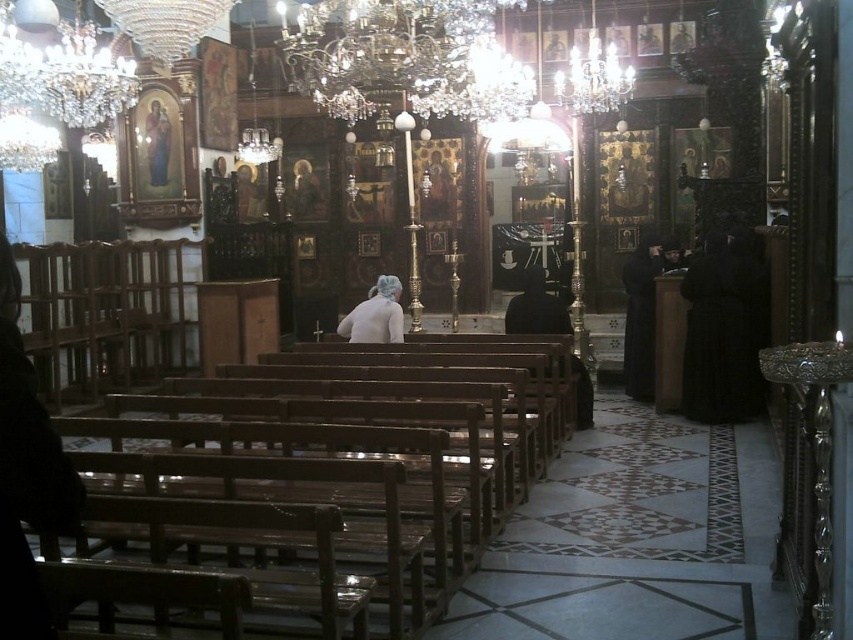
Is black velvet robe at center behind white matte hair at center?

Yes, it is behind white matte hair at center.

The image size is (853, 640). What do you see at coordinates (537, 307) in the screenshot?
I see `black velvet robe at center` at bounding box center [537, 307].

The height and width of the screenshot is (640, 853). Find the location of `black velvet robe at center`. black velvet robe at center is located at coordinates (537, 307).

Between crystal glass chandelier at upper center and white matte hair at center, which one is positioned higher?

crystal glass chandelier at upper center

Is point (54, 56) more distant than point (401, 340)?

Yes.

Locate an element on the screen. The image size is (853, 640). crystal glass chandelier at upper center is located at coordinates (64, 74).

Locate an element on the screen. crystal glass chandelier at upper center is located at coordinates (64, 74).

Between crystal glass chandelier at upper center and black velvet robe at center, which one has less height?

With less height is black velvet robe at center.

Can you confirm if crystal glass chandelier at upper center is taller than black velvet robe at center?

Indeed, crystal glass chandelier at upper center has a greater height compared to black velvet robe at center.

Which is in front, point (97, 115) or point (532, 305)?

Point (532, 305)

This screenshot has width=853, height=640. What are the coordinates of `crystal glass chandelier at upper center` in the screenshot? It's located at (64, 74).